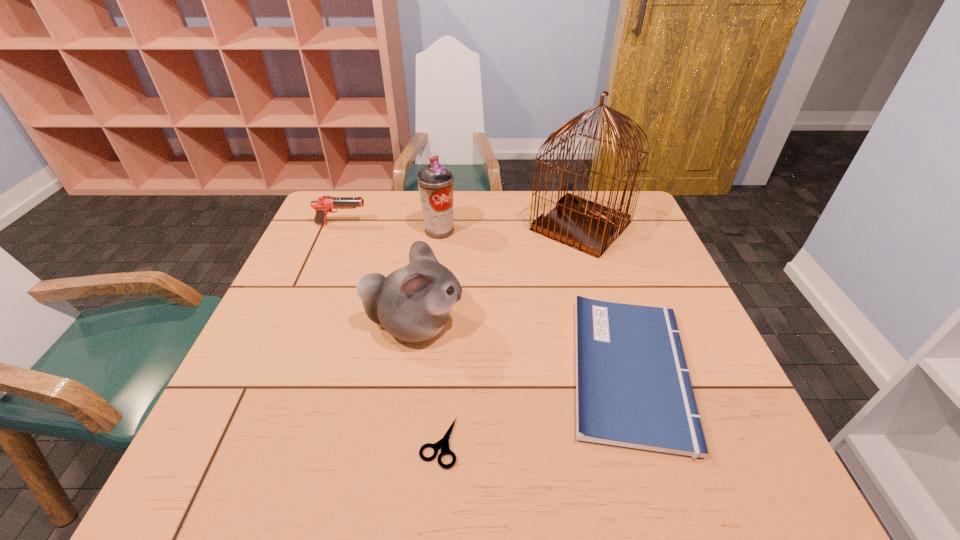
You are a GUI agent. You are given a task and a screenshot of the screen. Output one action in this format:
    pyautogui.click(x=<x>, y=<y>)
    Task: Click on the vacant area between the fifth tallest object and the aerosol can
    This screenshot has height=540, width=960.
    Given the screenshot: What is the action you would take?
    pyautogui.click(x=535, y=301)

This screenshot has width=960, height=540. I want to click on free space that is in between the tallest object and the fifth shortest object, so click(x=510, y=228).

At what (x,y) coordinates should I click in order to perform the action: click on vacant space in between the tallest object and the second tallest object. Please return your answer as a coordinate pair (x, y). Image resolution: width=960 pixels, height=540 pixels. Looking at the image, I should click on (510, 228).

Locate an element on the screen. This screenshot has width=960, height=540. vacant area that lies between the shortest object and the second tallest object is located at coordinates (439, 336).

Where is `free space between the hamster and the fifth tallest object`? free space between the hamster and the fifth tallest object is located at coordinates (522, 348).

The image size is (960, 540). What are the coordinates of `vacant space that is in between the birdcage and the fifth tallest object` in the screenshot? It's located at (605, 298).

Find the location of a particular element. unoccupied area between the shears and the second shortest object is located at coordinates (534, 407).

Select which object is the fourth closest to the aerosol can. Please provide its 2D coordinates. Your answer should be formatted as a tuple, i.e. [(x, y)], where the tuple contains the x and y coordinates of a point satisfying the conditions above.

[(633, 389)]

At what (x,y) coordinates should I click in order to perform the action: click on object that is the third closest to the paperback book. Please return your answer as a coordinate pair (x, y). Image resolution: width=960 pixels, height=540 pixels. Looking at the image, I should click on (443, 444).

Where is `free location that satisfies the following two spatial constraints: 1. at the aiming end of the fourth tallest object; 2. on the left side of the shortest object`? The image size is (960, 540). free location that satisfies the following two spatial constraints: 1. at the aiming end of the fourth tallest object; 2. on the left side of the shortest object is located at coordinates (250, 442).